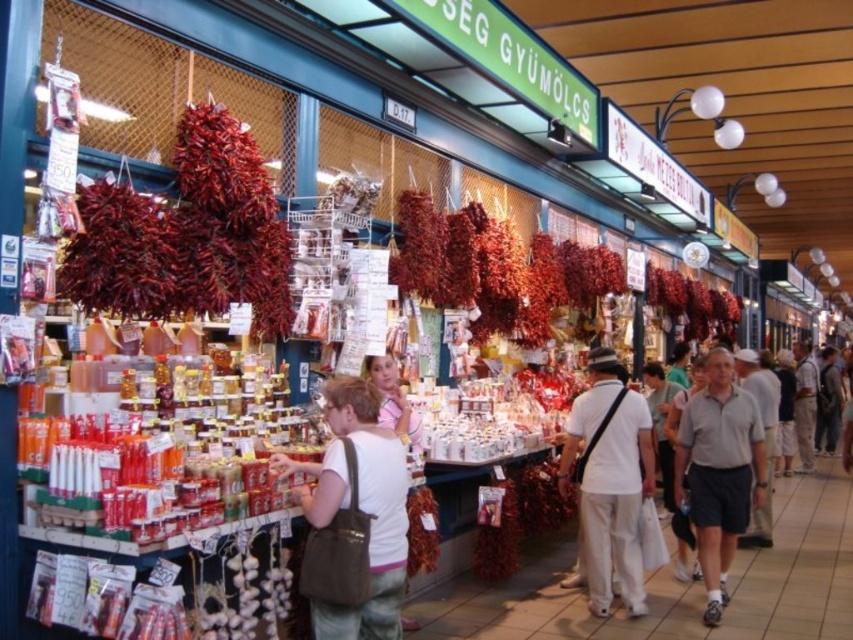
Question: Which of the following is the farthest from the observer?

Choices:
 (A) gray cotton shirt at center-right
 (B) dried red pepper at left
 (C) white cotton shirt at center

Answer: (C)

Question: Is dried red pepper at left to the left of dried red pepper at center from the viewer's perspective?

Choices:
 (A) yes
 (B) no

Answer: (A)

Question: Considering the real-world distances, which object is closest to the dried red pepper at center?

Choices:
 (A) dried red pepper at left
 (B) gray cotton shirt at center-right
 (C) white cotton shirt at center
 (D) matte brown bag at center

Answer: (B)

Question: Does dried red pepper at left appear under gray cotton shirt at center-right?

Choices:
 (A) no
 (B) yes

Answer: (A)

Question: Among these objects, which one is nearest to the camera?

Choices:
 (A) matte brown bag at center
 (B) dried red pepper at center
 (C) dried red pepper at left
 (D) gray cotton shirt at center-right

Answer: (A)

Question: Can you confirm if dried red pepper at left is thinner than white cotton shirt at center?

Choices:
 (A) yes
 (B) no

Answer: (B)